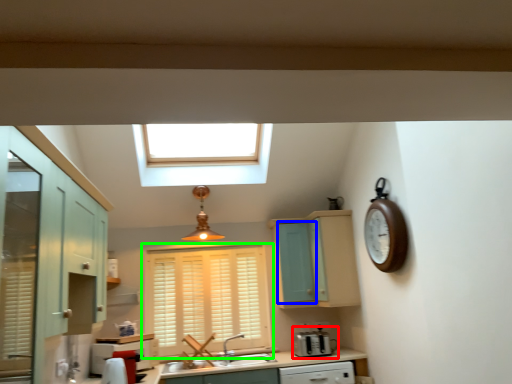
Question: Considering the real-world distances, which object is farthest from appliance (highlighted by a red box)? screen door (highlighted by a blue box) or window (highlighted by a green box)?

Choices:
 (A) screen door
 (B) window

Answer: (B)